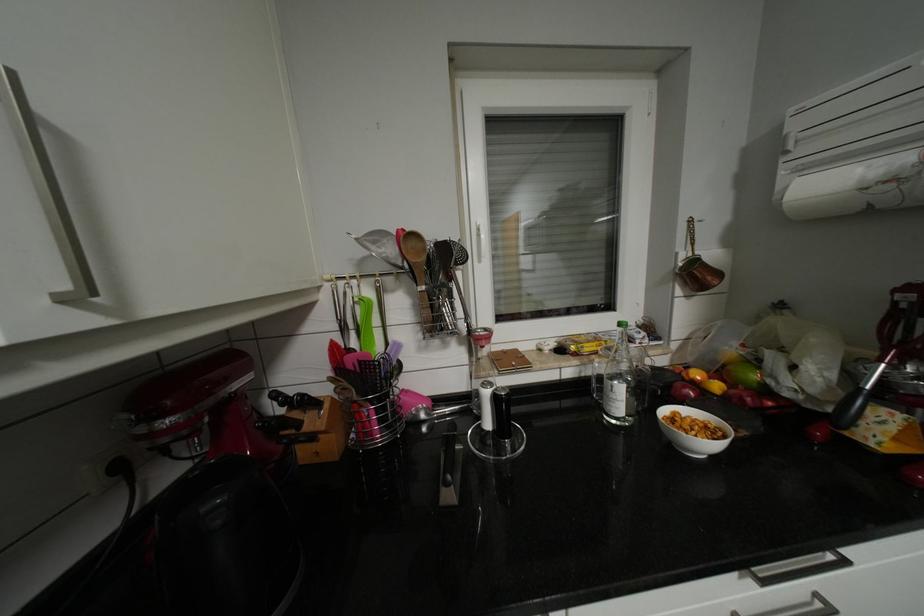
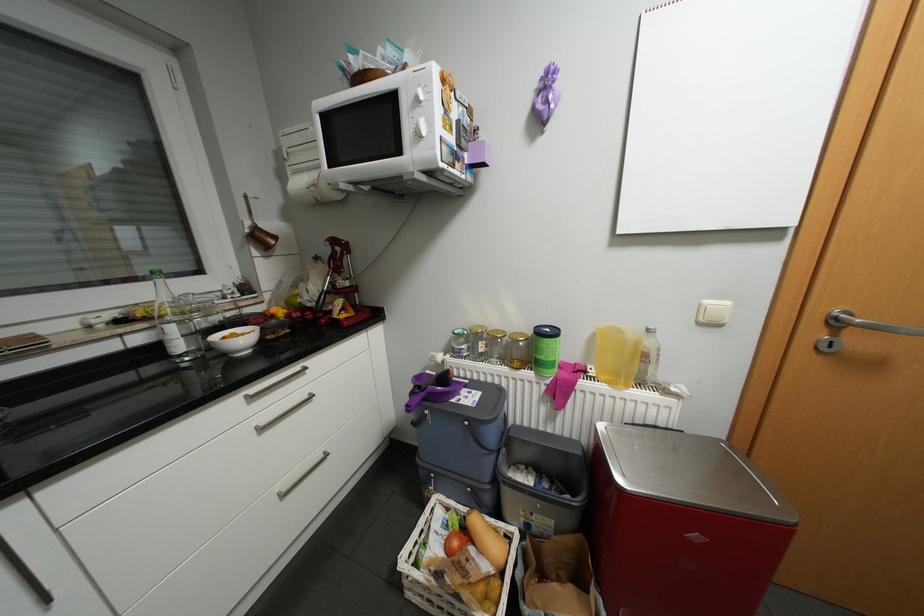
Locate, in the second image, the point that corresponds to pixel 810 169 in the first image.

(302, 172)